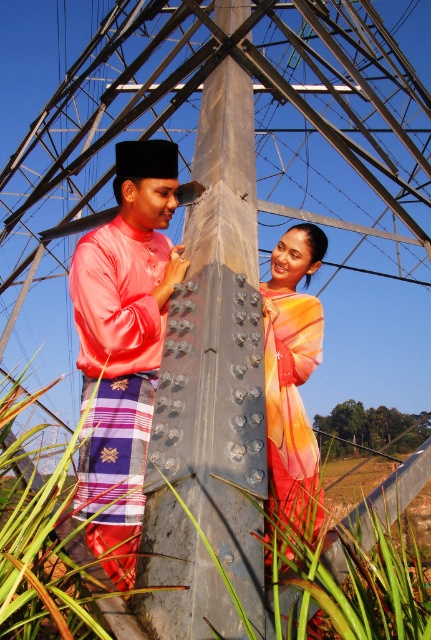
Question: Observing the image, what is the correct spatial positioning of satin pink shirt at center in reference to multicolored silk dress at center?

Choices:
 (A) above
 (B) below

Answer: (A)

Question: Where is metallic gray pole at center located in relation to silky pink shirt at center in the image?

Choices:
 (A) left
 (B) right

Answer: (B)

Question: Considering the real-world distances, which object is farthest from the metallic gray pole at center?

Choices:
 (A) satin pink shirt at center
 (B) silky pink shirt at center

Answer: (A)

Question: Which of the following is the farthest from the observer?

Choices:
 (A) silky pink shirt at center
 (B) satin pink shirt at center
 (C) metallic gray pole at center
 (D) multicolored silk dress at center

Answer: (D)

Question: Estimate the real-world distances between objects in this image. Which object is farther from the metallic gray pole at center?

Choices:
 (A) multicolored silk dress at center
 (B) silky pink shirt at center
 (C) satin pink shirt at center

Answer: (A)

Question: Can you confirm if metallic gray pole at center is positioned below satin pink shirt at center?

Choices:
 (A) yes
 (B) no

Answer: (B)